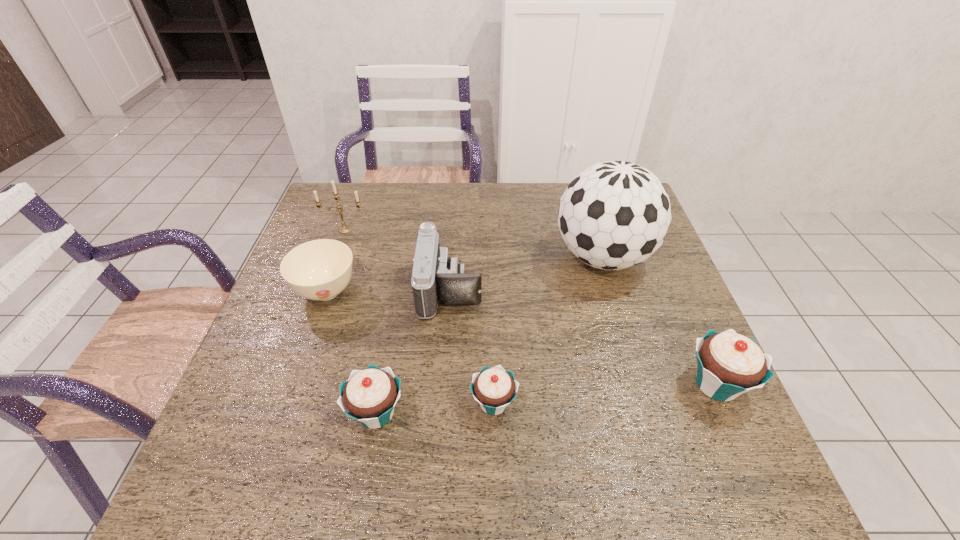
At what (x,y) coordinates should I click in order to perform the action: click on vacant position located on the right of the candle. Please return your answer as a coordinate pair (x, y). Looking at the image, I should click on (388, 230).

You are a GUI agent. You are given a task and a screenshot of the screen. Output one action in this format:
    pyautogui.click(x=<x>, y=<y>)
    Task: Click on the free space located at the front of the camera with an open lens cover
    The image size is (960, 540).
    Given the screenshot: What is the action you would take?
    pyautogui.click(x=500, y=289)

Locate an element on the screen. The width and height of the screenshot is (960, 540). vacant area situated 0.130m on the front of the soccer ball is located at coordinates (625, 332).

At what (x,y) coordinates should I click in order to perform the action: click on free spot located on the back of the sugar bowl. Please return your answer as a coordinate pair (x, y). The height and width of the screenshot is (540, 960). Looking at the image, I should click on (358, 202).

Image resolution: width=960 pixels, height=540 pixels. Find the location of `candle at the left edge`. candle at the left edge is located at coordinates (343, 229).

Locate an element on the screen. The image size is (960, 540). sugar bowl positioned at the left edge is located at coordinates (319, 270).

Identify the location of cupcake that is at the right edge. This screenshot has width=960, height=540. (728, 364).

Find the location of a particular element. soccer ball present at the right edge is located at coordinates (615, 214).

At what (x,y) coordinates should I click in order to perform the action: click on object at the near right corner. Please return your answer as a coordinate pair (x, y). The width and height of the screenshot is (960, 540). Looking at the image, I should click on (728, 364).

At what (x,y) coordinates should I click in order to perform the action: click on free spot at the far edge of the desktop. Please return your answer as a coordinate pair (x, y). Looking at the image, I should click on (438, 218).